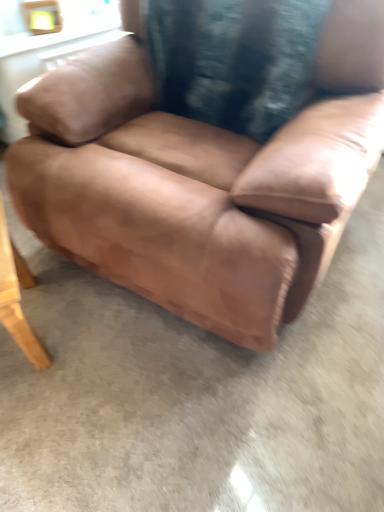
Question: Is velvety black pillow at center at the right side of brown leather chair at center?

Choices:
 (A) no
 (B) yes

Answer: (B)

Question: Considering the relative sizes of velvety black pillow at center and brown leather chair at center in the image provided, is velvety black pillow at center shorter than brown leather chair at center?

Choices:
 (A) no
 (B) yes

Answer: (B)

Question: Considering the relative sizes of velvety black pillow at center and brown leather chair at center in the image provided, is velvety black pillow at center thinner than brown leather chair at center?

Choices:
 (A) no
 (B) yes

Answer: (B)

Question: Is velvety black pillow at center not inside brown leather chair at center?

Choices:
 (A) yes
 (B) no

Answer: (B)

Question: Is brown leather chair at center inside velvety black pillow at center?

Choices:
 (A) yes
 (B) no

Answer: (B)

Question: Considering the positions of velvety black pillow at center and wooden table at lower left in the image, is velvety black pillow at center taller or shorter than wooden table at lower left?

Choices:
 (A) tall
 (B) short

Answer: (A)

Question: Is velvety black pillow at center bigger or smaller than wooden table at lower left?

Choices:
 (A) small
 (B) big

Answer: (B)

Question: Based on their positions, is velvety black pillow at center located to the left or right of wooden table at lower left?

Choices:
 (A) right
 (B) left

Answer: (A)

Question: From a real-world perspective, relative to wooden table at lower left, is velvety black pillow at center vertically above or below?

Choices:
 (A) below
 (B) above

Answer: (B)

Question: Is brown leather chair at center in front of or behind wooden table at lower left in the image?

Choices:
 (A) front
 (B) behind

Answer: (A)

Question: From a real-world perspective, relative to wooden table at lower left, is brown leather chair at center vertically above or below?

Choices:
 (A) above
 (B) below

Answer: (A)

Question: Do you think brown leather chair at center is within wooden table at lower left, or outside of it?

Choices:
 (A) outside
 (B) inside

Answer: (A)

Question: From the image's perspective, is brown leather chair at center above or below wooden table at lower left?

Choices:
 (A) below
 (B) above

Answer: (B)

Question: Is point (23, 326) positioned closer to the camera than point (288, 97)?

Choices:
 (A) farther
 (B) closer

Answer: (B)

Question: Considering the positions of wooden table at lower left and velvety black pillow at center in the image, is wooden table at lower left bigger or smaller than velvety black pillow at center?

Choices:
 (A) big
 (B) small

Answer: (B)